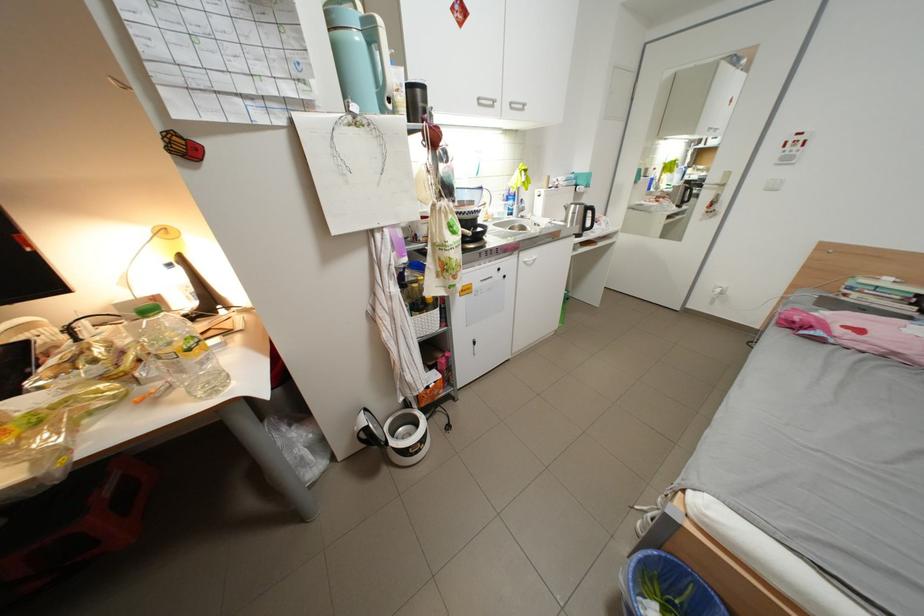
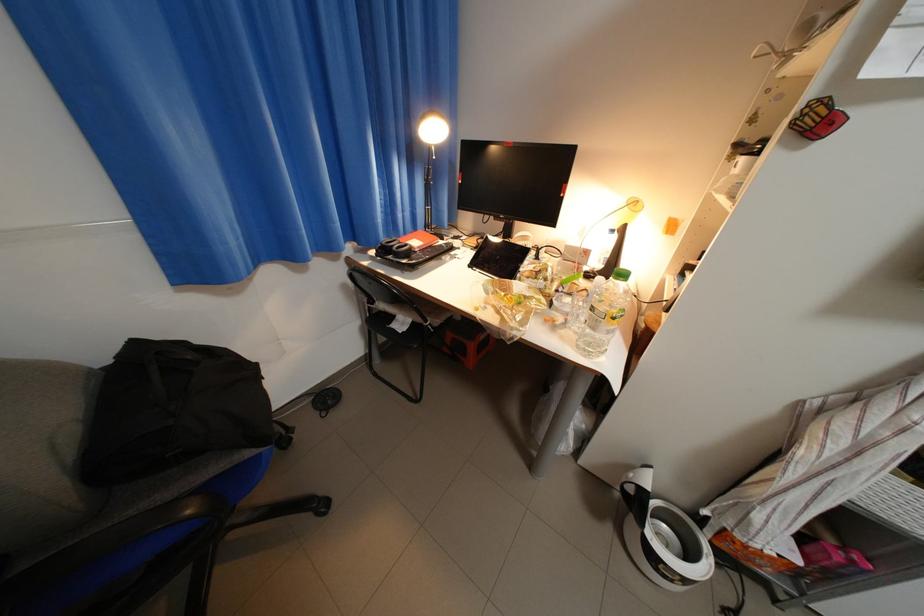
In the second image, find the point that corresponds to [434,442] in the first image.

(698, 582)